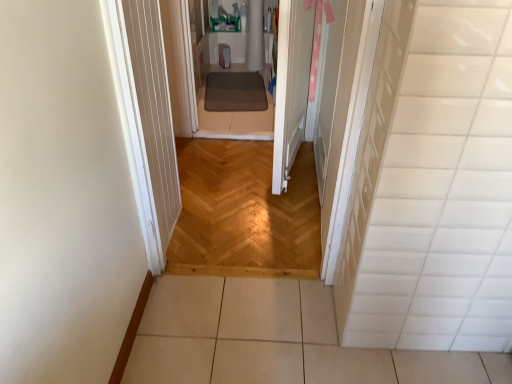
Image resolution: width=512 pixels, height=384 pixels. What are the coordinates of `vacant region to the left of white glossy tile at right` in the screenshot? It's located at (335, 345).